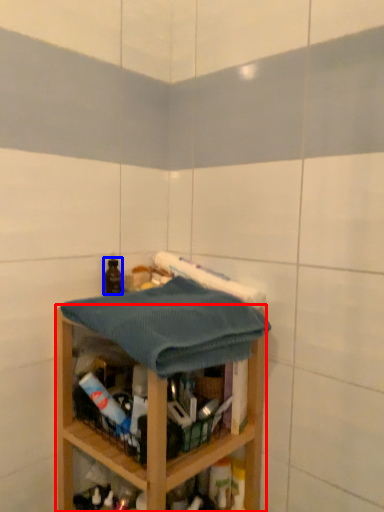
Question: Which object is further to the camera taking this photo, shelf (highlighted by a red box) or bottle (highlighted by a blue box)?

Choices:
 (A) shelf
 (B) bottle

Answer: (B)